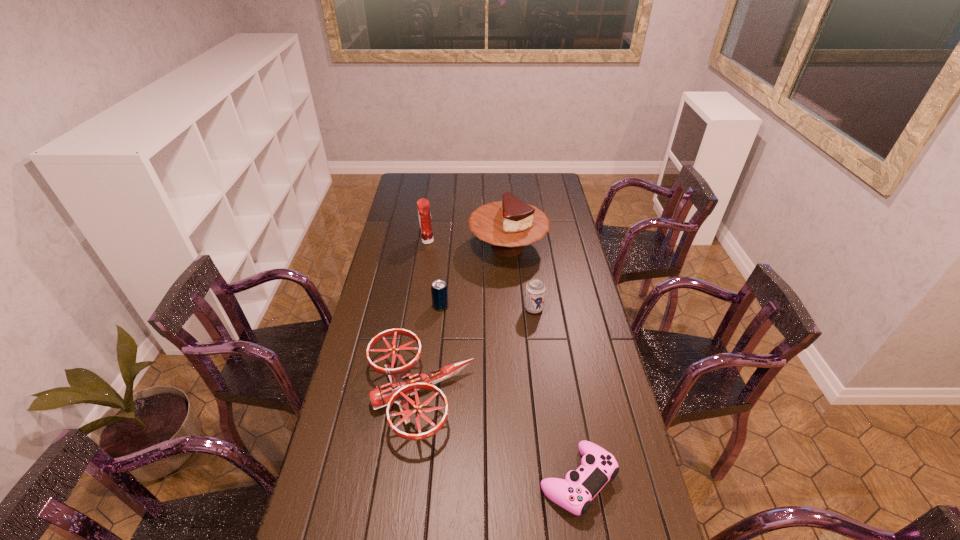
I want to click on free space located on the right of the drone, so click(x=499, y=395).

The width and height of the screenshot is (960, 540). In order to click on free region located 0.350m on the left of the shortest object in this screenshot , I will do `click(409, 481)`.

Locate an element on the screen. The width and height of the screenshot is (960, 540). object located in the left edge section of the desktop is located at coordinates (402, 384).

I want to click on cake that is at the right edge, so click(509, 225).

Identify the location of control located in the right edge section of the desktop. This screenshot has height=540, width=960. (598, 466).

Where is `vacant space at the far edge of the desktop`? The image size is (960, 540). vacant space at the far edge of the desktop is located at coordinates (456, 178).

The width and height of the screenshot is (960, 540). In order to click on vacant region at the left edge in this screenshot , I will do `click(335, 447)`.

Locate an element on the screen. Image resolution: width=960 pixels, height=540 pixels. vacant position at the right edge of the desktop is located at coordinates (602, 398).

Locate an element on the screen. The width and height of the screenshot is (960, 540). unoccupied area between the drone and the shortest object is located at coordinates (498, 437).

Locate an element on the screen. This screenshot has height=540, width=960. vacant region between the cake and the control is located at coordinates (542, 364).